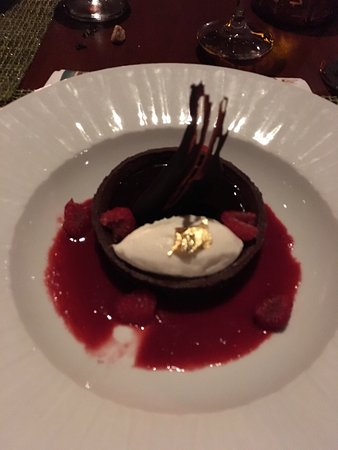
Where is `table`? The height and width of the screenshot is (450, 338). table is located at coordinates (159, 33).